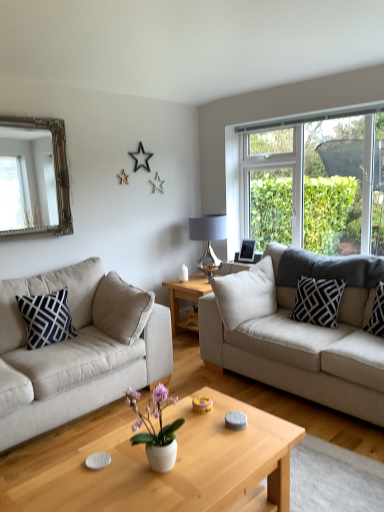
The image size is (384, 512). What are the coordinates of `free spot above light wood coffee table at center, which is counted as the 1th coffee table, starting from the bottom (from a real-world perspective)` in the screenshot? It's located at (173, 462).